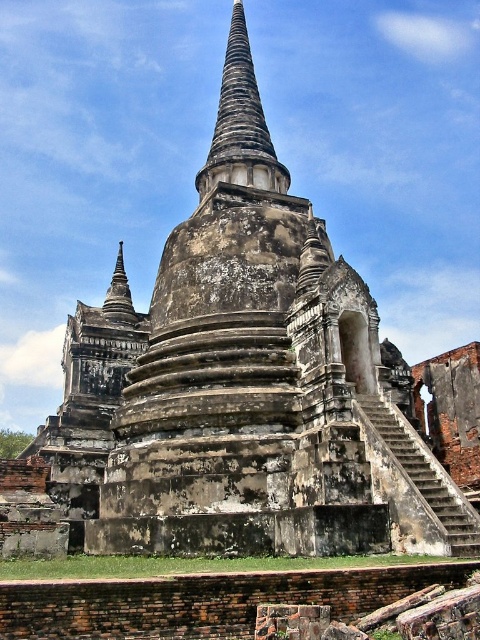
Is weathered stone spire at center positioned in front of dark brown stone spire at upper left?

Yes, it is in front of dark brown stone spire at upper left.

Is weathered stone spire at center below dark brown stone spire at upper left?

No.

Which is in front, point (240, 102) or point (121, 316)?

Point (121, 316) is more forward.

I want to click on weathered stone spire at center, so click(x=240, y=124).